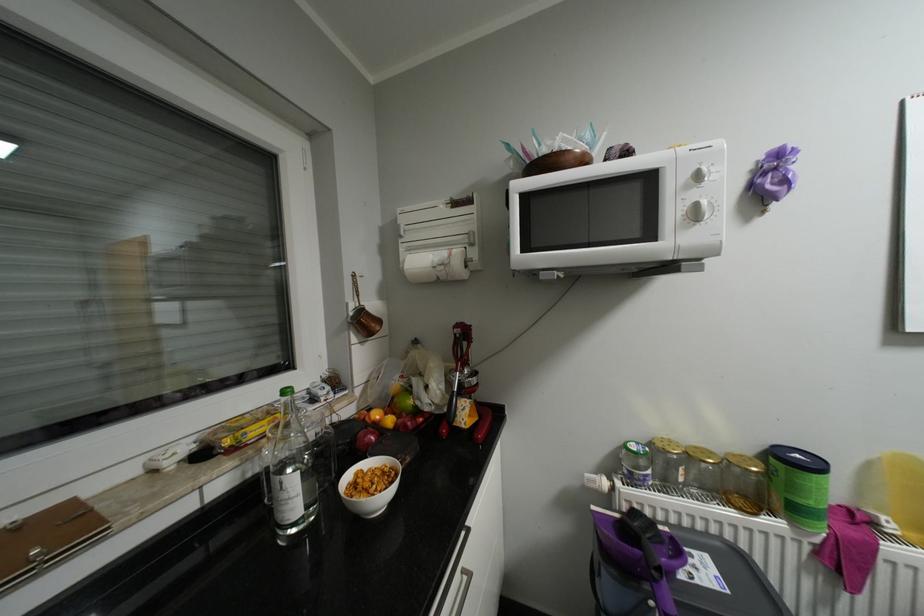
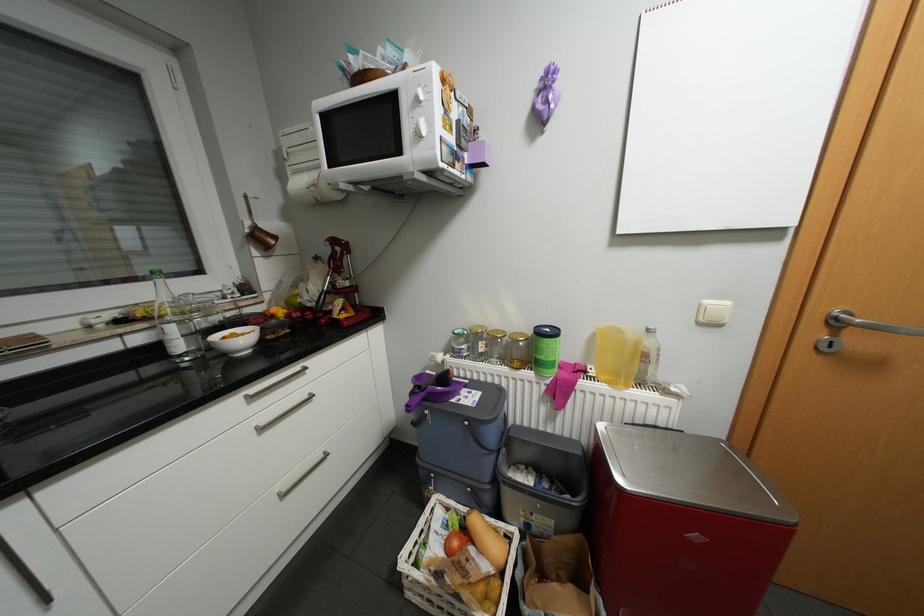
In the second image, find the point that corresponds to (162,469) in the first image.

(96, 326)